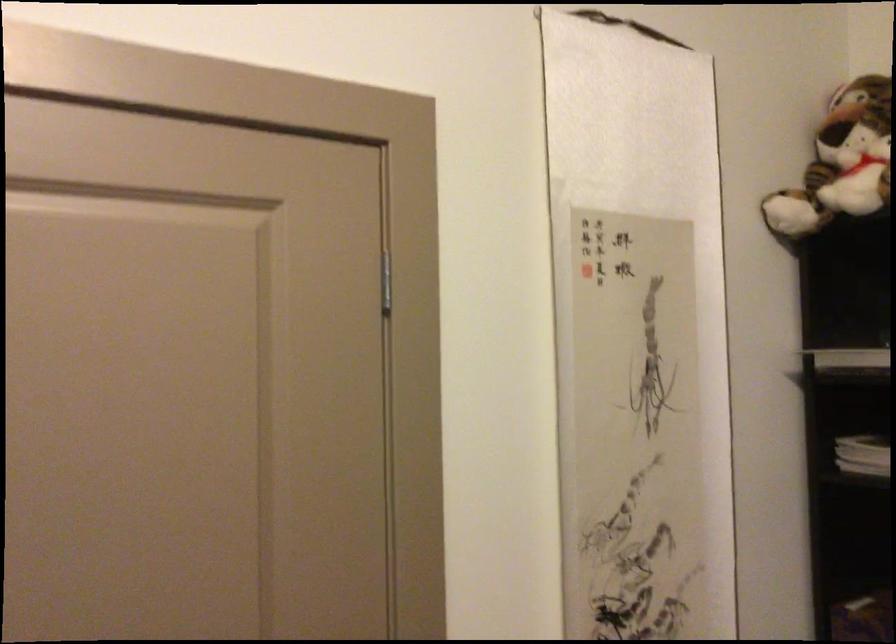
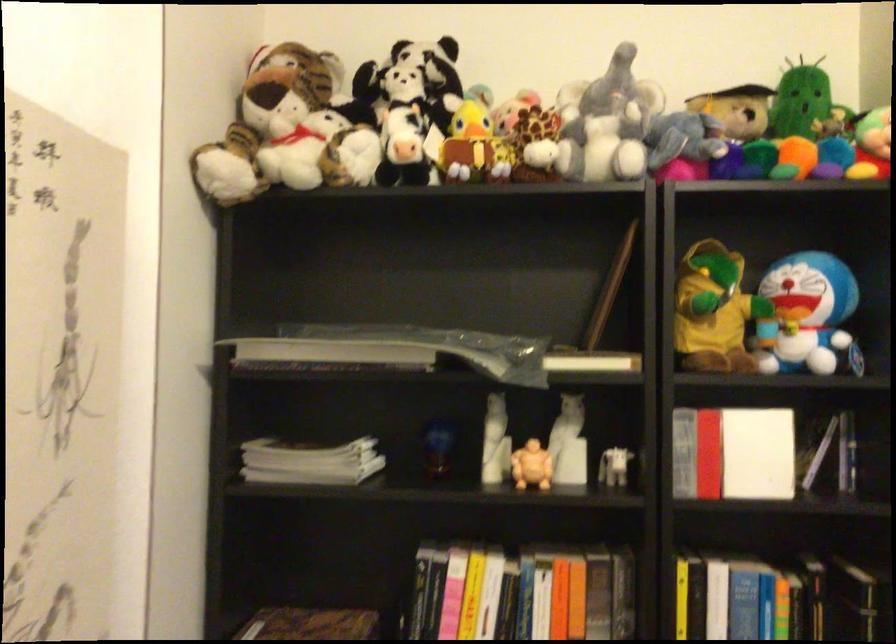
Question: Based on the continuous images, in which direction is the camera rotating? Reply with the corresponding letter.

Choices:
 (A) Left
 (B) Right
 (C) Up
 (D) Down

Answer: (B)